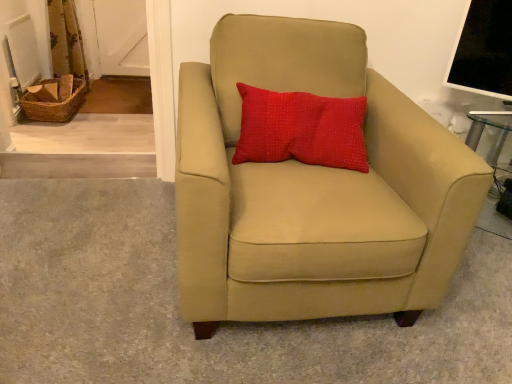
Question: Can you confirm if red textured pillow at upper center is shorter than suede beige armchair at center?

Choices:
 (A) no
 (B) yes

Answer: (B)

Question: Is red textured pillow at upper center facing away from suede beige armchair at center?

Choices:
 (A) no
 (B) yes

Answer: (B)

Question: From the image's perspective, is red textured pillow at upper center under suede beige armchair at center?

Choices:
 (A) yes
 (B) no

Answer: (B)

Question: Does red textured pillow at upper center have a larger size compared to suede beige armchair at center?

Choices:
 (A) yes
 (B) no

Answer: (B)

Question: Is red textured pillow at upper center not near suede beige armchair at center?

Choices:
 (A) no
 (B) yes

Answer: (A)

Question: In the image, is red textured pillow at upper center positioned in front of or behind suede beige armchair at center?

Choices:
 (A) behind
 (B) front

Answer: (A)

Question: Choose the correct answer: Is red textured pillow at upper center inside suede beige armchair at center or outside it?

Choices:
 (A) outside
 (B) inside

Answer: (B)

Question: Is red textured pillow at upper center wider or thinner than suede beige armchair at center?

Choices:
 (A) thin
 (B) wide

Answer: (A)

Question: In terms of size, does red textured pillow at upper center appear bigger or smaller than suede beige armchair at center?

Choices:
 (A) small
 (B) big

Answer: (A)

Question: Is suede beige armchair at center in front of or behind red textured pillow at upper center in the image?

Choices:
 (A) behind
 (B) front

Answer: (B)

Question: Is suede beige armchair at center inside or outside of red textured pillow at upper center?

Choices:
 (A) inside
 (B) outside

Answer: (B)

Question: From a real-world perspective, is suede beige armchair at center above or below red textured pillow at upper center?

Choices:
 (A) below
 (B) above

Answer: (A)

Question: Looking at the image, does suede beige armchair at center seem bigger or smaller compared to red textured pillow at upper center?

Choices:
 (A) big
 (B) small

Answer: (A)

Question: Considering the positions of floral fabric curtain at upper left and suede beige armchair at center in the image, is floral fabric curtain at upper left wider or thinner than suede beige armchair at center?

Choices:
 (A) wide
 (B) thin

Answer: (B)

Question: In the image, is floral fabric curtain at upper left on the left side or the right side of suede beige armchair at center?

Choices:
 (A) right
 (B) left

Answer: (B)